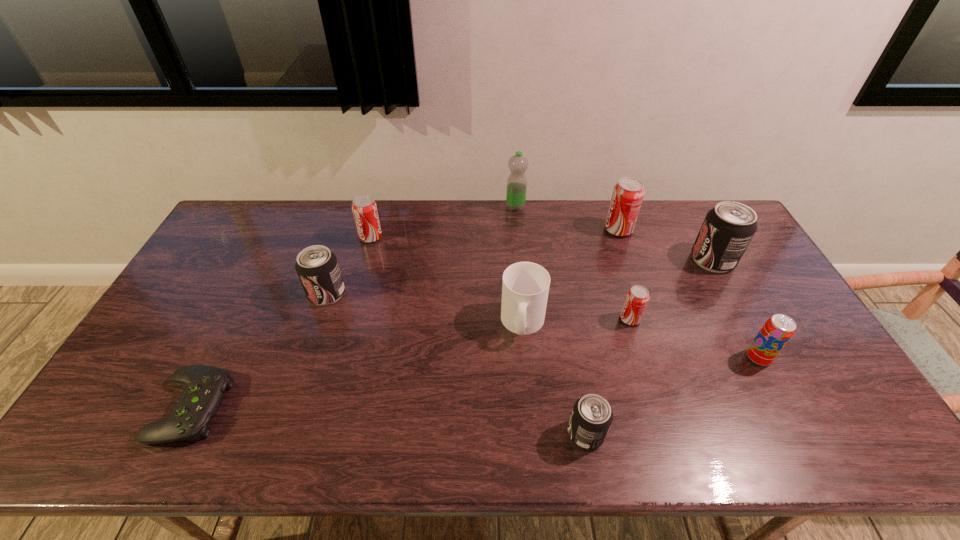
Where is `the third nearest soda can`? The width and height of the screenshot is (960, 540). the third nearest soda can is located at coordinates (636, 300).

The image size is (960, 540). I want to click on the nearest red soda can, so click(636, 300).

Where is `the nearest black soda can`? the nearest black soda can is located at coordinates (591, 417).

This screenshot has height=540, width=960. In order to click on the fifth soda can from right to left in this screenshot , I will do 591,417.

What are the coordinates of `control` in the screenshot? It's located at (205, 386).

I want to click on the leftmost object, so click(x=205, y=386).

Identify the location of vacant region located on the left of the farthest object. (488, 207).

Identify the location of vacant space situated on the logo side of the biggest red soda can. (495, 230).

Image resolution: width=960 pixels, height=540 pixels. I want to click on free space located on the logo side of the biggest red soda can, so click(x=513, y=230).

The height and width of the screenshot is (540, 960). What are the coordinates of `blank space located on the logo side of the biggest red soda can` in the screenshot? It's located at (513, 230).